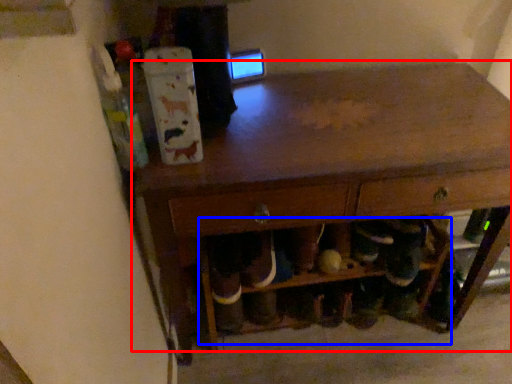
Question: Which of the following is the farthest to the observer, table (highlighted by a red box) or shelf (highlighted by a blue box)?

Choices:
 (A) table
 (B) shelf

Answer: (B)